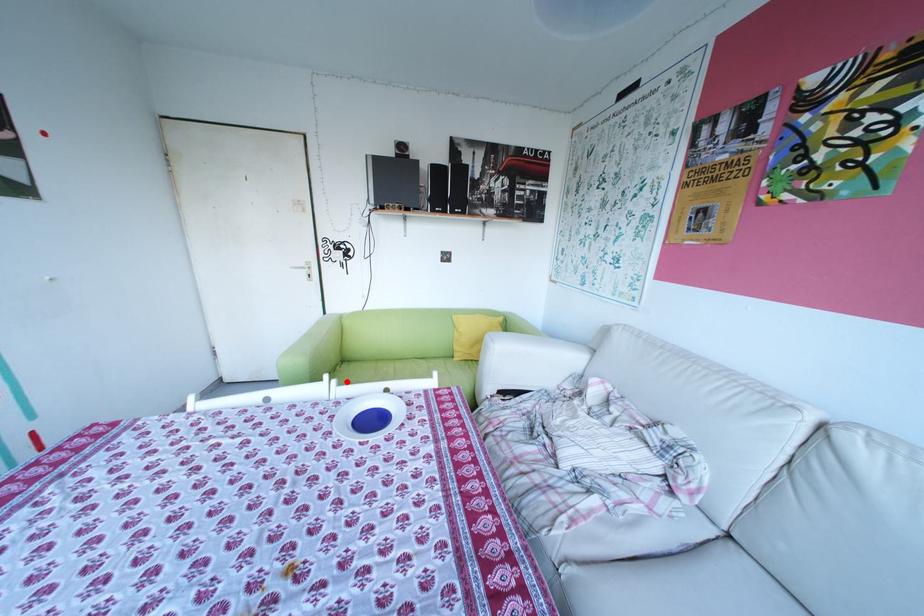
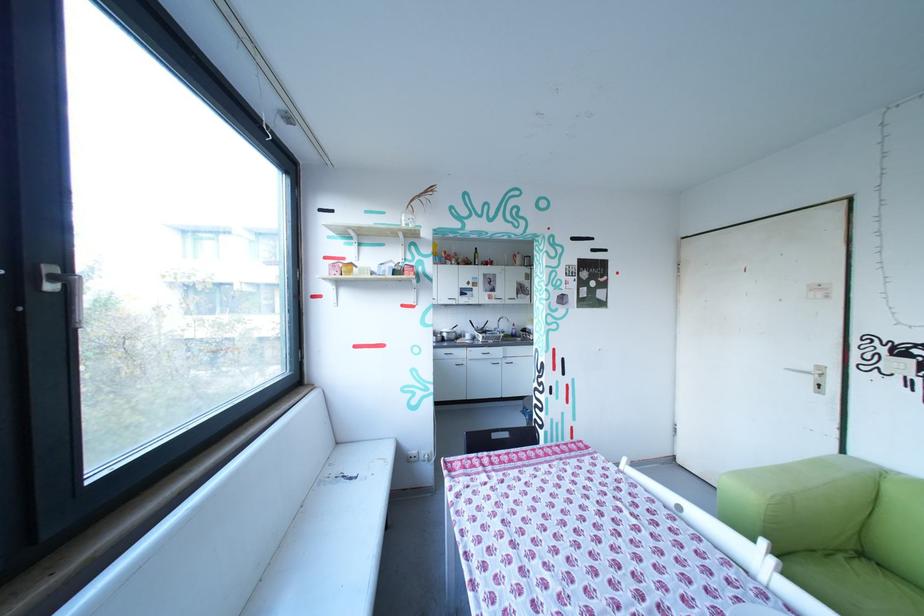
In the second image, find the point that corresponds to the highlighted location in the first image.

(785, 562)